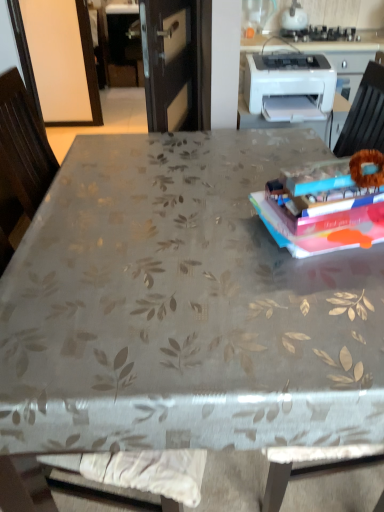
Where is `vacant space in front of hardcover book at upper right`? The image size is (384, 512). vacant space in front of hardcover book at upper right is located at coordinates (314, 314).